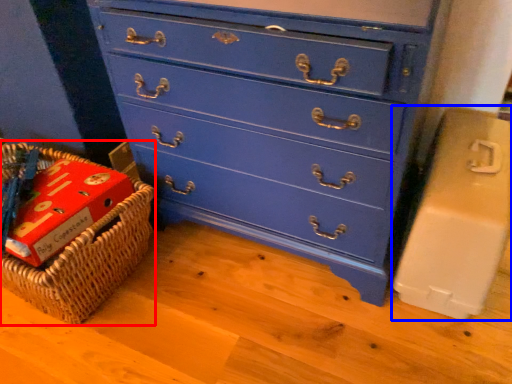
Question: Which object appears closest to the camera in this image, basket (highlighted by a red box) or cardboard box (highlighted by a blue box)?

Choices:
 (A) basket
 (B) cardboard box

Answer: (B)